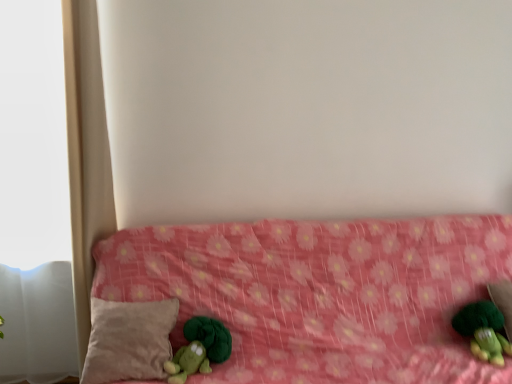
Question: From a real-world perspective, is pink fabric bed at center under beige soft pillow at lower left?

Choices:
 (A) yes
 (B) no

Answer: (A)

Question: Is pink fabric bed at center taller than beige soft pillow at lower left?

Choices:
 (A) yes
 (B) no

Answer: (A)

Question: From a real-world perspective, is pink fabric bed at center physically above beige soft pillow at lower left?

Choices:
 (A) yes
 (B) no

Answer: (B)

Question: Does pink fabric bed at center have a lesser width compared to beige soft pillow at lower left?

Choices:
 (A) yes
 (B) no

Answer: (B)

Question: Are pink fabric bed at center and beige soft pillow at lower left far apart?

Choices:
 (A) no
 (B) yes

Answer: (A)

Question: From the image's perspective, is pink fabric bed at center located beneath beige soft pillow at lower left?

Choices:
 (A) yes
 (B) no

Answer: (A)

Question: Can you confirm if pink fabric bed at center is shorter than green plush toy at lower right, positioned as the first toy in right-to-left order?

Choices:
 (A) no
 (B) yes

Answer: (A)

Question: Does pink fabric bed at center turn towards green plush toy at lower right, the second toy when ordered from left to right?

Choices:
 (A) yes
 (B) no

Answer: (A)

Question: Can green plush toy at lower right, positioned as the first toy in right-to-left order, be found inside pink fabric bed at center?

Choices:
 (A) yes
 (B) no

Answer: (A)

Question: Can you confirm if pink fabric bed at center is thinner than green plush toy at lower right, the second toy when ordered from left to right?

Choices:
 (A) no
 (B) yes

Answer: (A)

Question: Is pink fabric bed at center behind green plush toy at lower right, the second toy when ordered from left to right?

Choices:
 (A) no
 (B) yes

Answer: (A)

Question: Is the surface of pink fabric bed at center in direct contact with green plush toy at lower right, the second toy when ordered from left to right?

Choices:
 (A) no
 (B) yes

Answer: (A)

Question: Can you confirm if beige soft pillow at lower left is thinner than green plush toy at lower left, placed as the 2th toy when sorted from right to left?

Choices:
 (A) no
 (B) yes

Answer: (A)